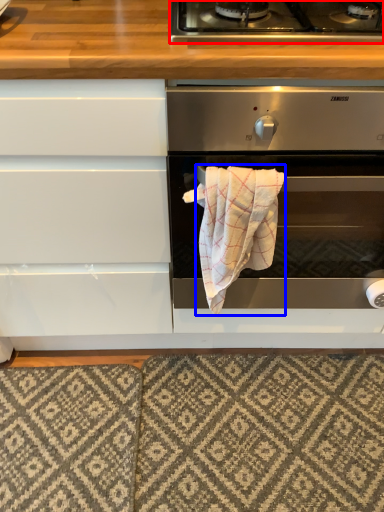
Question: Which object appears closest to the camera in this image, gas stove (highlighted by a red box) or bath towel (highlighted by a blue box)?

Choices:
 (A) gas stove
 (B) bath towel

Answer: (A)